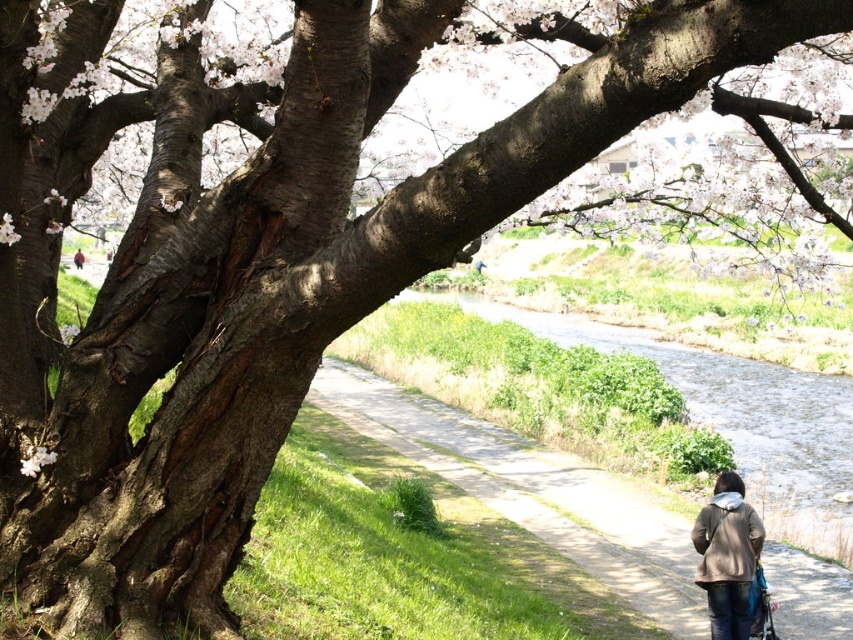
Question: Which point is closer to the camera?

Choices:
 (A) green grassy pavement at lower center
 (B) brown textured jacket at lower right

Answer: (B)

Question: Does green grassy pavement at lower center appear over brown textured jacket at lower right?

Choices:
 (A) no
 (B) yes

Answer: (B)

Question: Does green grassy pavement at lower center appear on the right side of brown textured jacket at lower right?

Choices:
 (A) no
 (B) yes

Answer: (A)

Question: Is green grassy pavement at lower center smaller than brown textured jacket at lower right?

Choices:
 (A) yes
 (B) no

Answer: (B)

Question: Which of the following is the closest to the observer?

Choices:
 (A) (409, 445)
 (B) (717, 499)

Answer: (B)